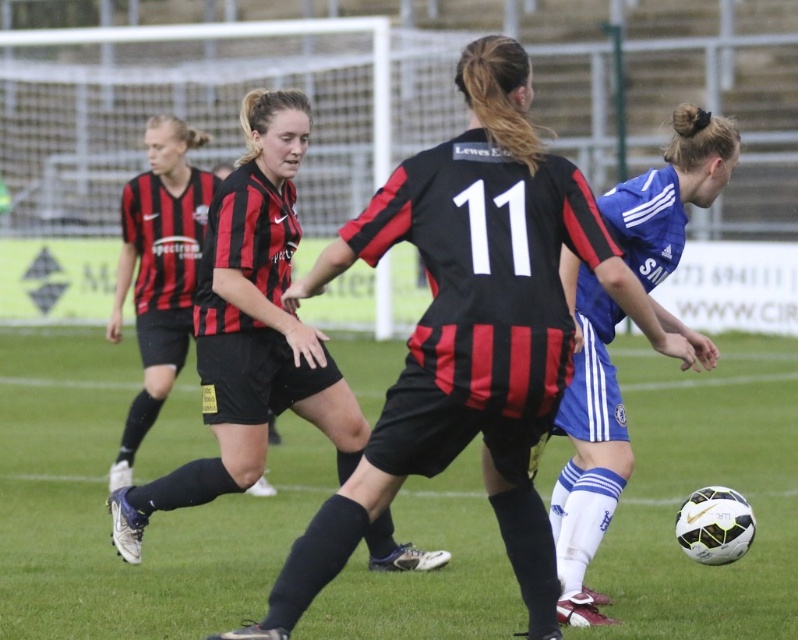
Question: Can you confirm if black matte soccer jersey at center is positioned below black and red striped jersey at center?

Choices:
 (A) no
 (B) yes

Answer: (B)

Question: Which point is farther to the camera?

Choices:
 (A) black and red striped jersey at center
 (B) blue jersey at center

Answer: (A)

Question: Among these objects, which one is nearest to the camera?

Choices:
 (A) black matte soccer jersey at center
 (B) green grass football field at center
 (C) blue jersey at center
 (D) black and red striped jersey at center

Answer: (C)

Question: Which of the following is the closest to the observer?

Choices:
 (A) blue jersey at center
 (B) green grass football field at center
 (C) black matte soccer jersey at center

Answer: (A)

Question: Does green grass football field at center have a greater width compared to black and red striped jersey at center?

Choices:
 (A) no
 (B) yes

Answer: (B)

Question: Can you confirm if black matte soccer jersey at center is positioned to the right of black and red striped jersey at center?

Choices:
 (A) yes
 (B) no

Answer: (A)